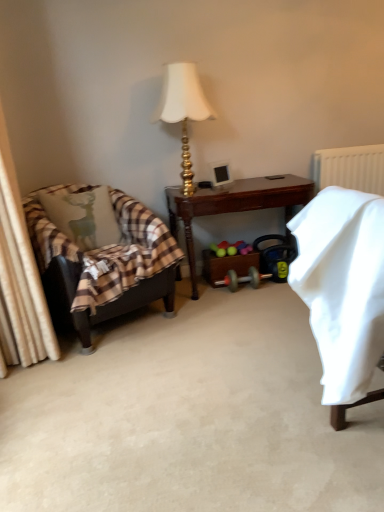
What is the approximate height of gold metallic lamp at upper center?

29.11 inches.

At what (x,y) coordinates should I click in order to perform the action: click on white plastic radiator at upper right. Please return your answer as a coordinate pair (x, y). Looking at the image, I should click on (350, 168).

You are a GUI agent. You are given a task and a screenshot of the screen. Output one action in this format:
    pyautogui.click(x=<x>, y=<y>)
    Task: Click on the brown wooden desk at center
    
    Given the screenshot: What is the action you would take?
    pyautogui.click(x=233, y=205)

From the image's perspective, would you say white plastic radiator at upper right is positioned over white soft blanket at right?

Correct, white plastic radiator at upper right appears higher than white soft blanket at right in the image.

Who is shorter, white plastic radiator at upper right or white soft blanket at right?

white plastic radiator at upper right is shorter.

The height and width of the screenshot is (512, 384). What are the coordinates of `blanket lying below the white plastic radiator at upper right (from the image's perspective)` in the screenshot? It's located at (342, 286).

Between white plastic radiator at upper right and white soft blanket at right, which one appears on the right side from the viewer's perspective?

From the viewer's perspective, white plastic radiator at upper right appears more on the right side.

Is brown wooden desk at center turned away from gold metallic lamp at upper center?

brown wooden desk at center is not turned away from gold metallic lamp at upper center.

How different are the orientations of brown wooden desk at center and gold metallic lamp at upper center in degrees?

The angular difference between brown wooden desk at center and gold metallic lamp at upper center is 2.18 degrees.

Between brown wooden desk at center and gold metallic lamp at upper center, which one has smaller size?

gold metallic lamp at upper center is smaller.

Considering the points (218, 204) and (182, 68), which point is in front, point (218, 204) or point (182, 68)?

The point (182, 68) is in front.

Is point (169, 194) closer to camera compared to point (96, 296)?

No, (169, 194) is behind (96, 296).

Does brown wooden desk at center have a lesser width compared to leather armchair at left?

Yes.

Consider the image. Is brown wooden desk at center facing towards leather armchair at left?

No.

Considering the relative positions of brown wooden desk at center and leather armchair at left in the image provided, is brown wooden desk at center to the left or to the right of leather armchair at left?

brown wooden desk at center is positioned on leather armchair at left's right side.

Which is behind, point (172, 242) or point (332, 258)?

Positioned behind is point (172, 242).

Are leather armchair at left and white soft blanket at right beside each other?

They are not placed beside each other.

From the image's perspective, is leather armchair at left on white soft blanket at right?

Yes, from the image's perspective, leather armchair at left is over white soft blanket at right.

How many degrees apart are the facing directions of leather armchair at left and white soft blanket at right?

There is a 61.3-degree angle between the facing directions of leather armchair at left and white soft blanket at right.

Which of these two, gold metallic lamp at upper center or white plastic radiator at upper right, is wider?

Wider between the two is gold metallic lamp at upper center.

From the image's perspective, is gold metallic lamp at upper center above white plastic radiator at upper right?

Yes, from the image's perspective, gold metallic lamp at upper center is on top of white plastic radiator at upper right.

From the picture: Between gold metallic lamp at upper center and white plastic radiator at upper right, which one has smaller size?

white plastic radiator at upper right.

Considering the relative sizes of light green fabric pillow with deer print at left and gold metallic lamp at upper center in the image provided, is light green fabric pillow with deer print at left bigger than gold metallic lamp at upper center?

Incorrect, light green fabric pillow with deer print at left is not larger than gold metallic lamp at upper center.

The image size is (384, 512). I want to click on lamp on the right of the light green fabric pillow with deer print at left, so click(x=183, y=110).

Can you confirm if light green fabric pillow with deer print at left is positioned to the right of gold metallic lamp at upper center?

No.

Would you say gold metallic lamp at upper center is part of light green fabric pillow with deer print at left's contents?

No, gold metallic lamp at upper center is not inside light green fabric pillow with deer print at left.

Is brown wooden desk at center not inside white plastic radiator at upper right?

Indeed, brown wooden desk at center is completely outside white plastic radiator at upper right.

From the image's perspective, which is below, brown wooden desk at center or white plastic radiator at upper right?

brown wooden desk at center appears lower in the image.

Does brown wooden desk at center appear on the left side of white plastic radiator at upper right?

Correct, you'll find brown wooden desk at center to the left of white plastic radiator at upper right.

Is brown wooden desk at center looking in the opposite direction of white plastic radiator at upper right?

No, brown wooden desk at center is not facing the opposite direction of white plastic radiator at upper right.

Where is `blanket located above the white plastic radiator at upper right (from a real-world perspective)`? Image resolution: width=384 pixels, height=512 pixels. blanket located above the white plastic radiator at upper right (from a real-world perspective) is located at coordinates click(342, 286).

Identify the location of desk that is below the gold metallic lamp at upper center (from the image's perspective). The height and width of the screenshot is (512, 384). (233, 205).

Considering their positions, is leather armchair at left positioned further to brown wooden desk at center than white soft blanket at right?

Among the two, white soft blanket at right is located further to brown wooden desk at center.

Based on their spatial positions, is light green fabric pillow with deer print at left or brown wooden desk at center further from gold metallic lamp at upper center?

light green fabric pillow with deer print at left lies further to gold metallic lamp at upper center than the other object.

Which object lies further to the anchor point gold metallic lamp at upper center, brown wooden desk at center or white plastic radiator at upper right?

white plastic radiator at upper right is positioned further to the anchor gold metallic lamp at upper center.

Considering their positions, is brown wooden desk at center positioned closer to leather armchair at left than gold metallic lamp at upper center?

brown wooden desk at center.

Which object lies nearer to the anchor point gold metallic lamp at upper center, brown wooden desk at center or white soft blanket at right?

Among the two, brown wooden desk at center is located nearer to gold metallic lamp at upper center.

Based on their spatial positions, is brown wooden desk at center or light green fabric pillow with deer print at left closer to white plastic radiator at upper right?

brown wooden desk at center.

Based on their spatial positions, is light green fabric pillow with deer print at left or gold metallic lamp at upper center further from leather armchair at left?

gold metallic lamp at upper center is further to leather armchair at left.

Looking at the image, which one is located closer to brown wooden desk at center, gold metallic lamp at upper center or white plastic radiator at upper right?

gold metallic lamp at upper center is positioned closer to the anchor brown wooden desk at center.

This screenshot has height=512, width=384. I want to click on lamp between leather armchair at left and white plastic radiator at upper right, so click(x=183, y=110).

Identify the location of chair positioned between white soft blanket at right and gold metallic lamp at upper center from near to far. (102, 264).

Where is `pillow between gold metallic lamp at upper center and leather armchair at left in the up-down direction`? This screenshot has width=384, height=512. pillow between gold metallic lamp at upper center and leather armchair at left in the up-down direction is located at coordinates coord(83,217).

You are a GUI agent. You are given a task and a screenshot of the screen. Output one action in this format:
    pyautogui.click(x=<x>, y=<y>)
    Task: Click on the chair positioned between white soft blanket at right and white plastic radiator at upper right from near to far
    The image size is (384, 512).
    Given the screenshot: What is the action you would take?
    pyautogui.click(x=102, y=264)